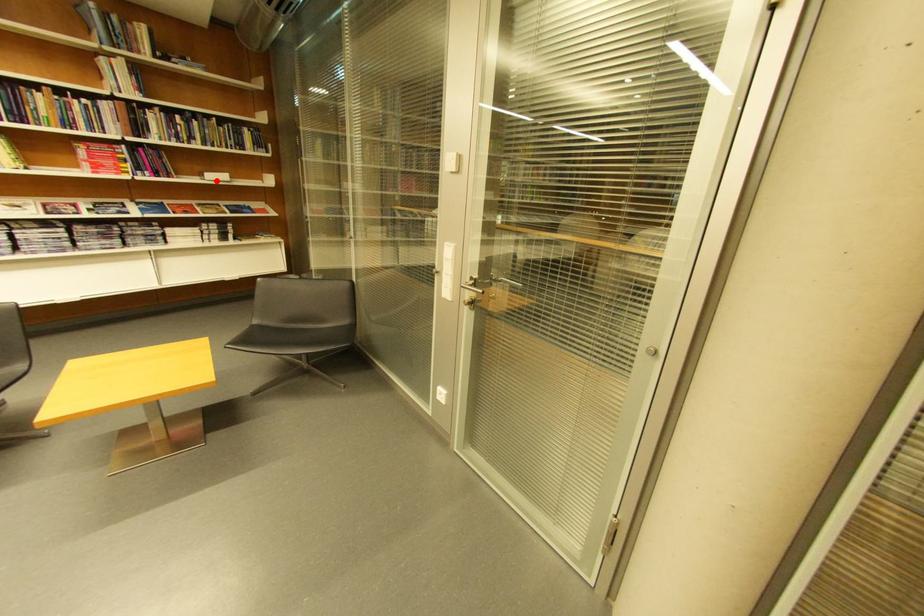
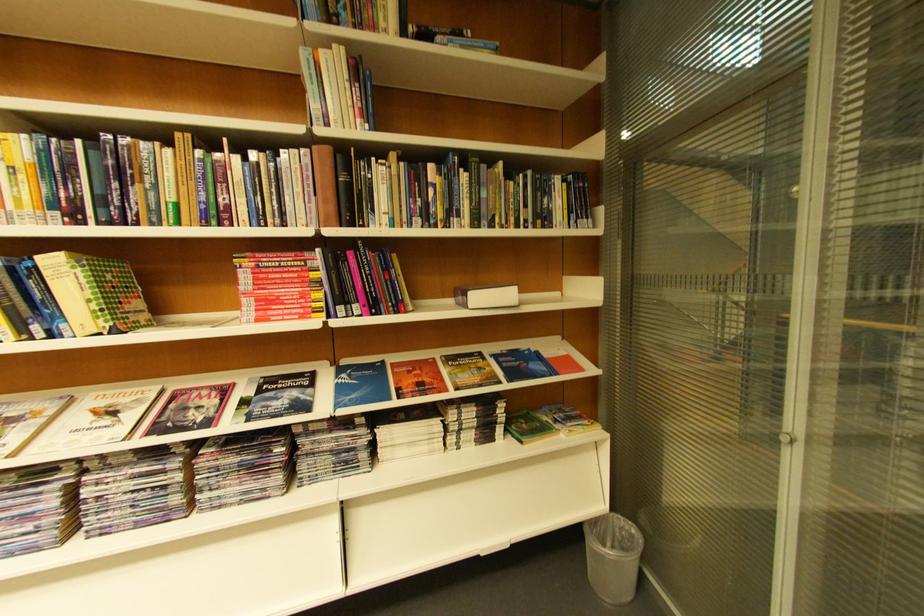
Where in the second image is the point corresponding to the highlighted location from the first image?

(480, 309)